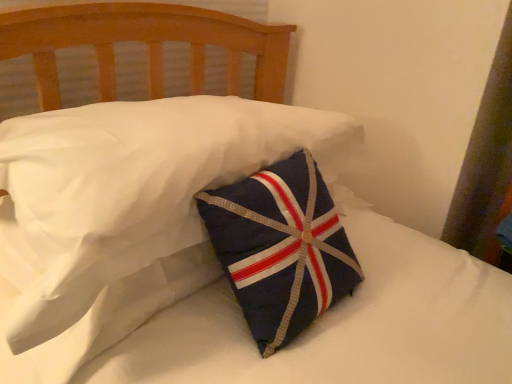
Measure the distance between navy fabric pillow at center and camera.

navy fabric pillow at center and camera are 18.88 inches apart from each other.

What do you see at coordinates (132, 201) in the screenshot? Image resolution: width=512 pixels, height=384 pixels. I see `navy fabric pillow at center` at bounding box center [132, 201].

Locate an element on the screen. Image resolution: width=512 pixels, height=384 pixels. navy fabric pillow at center is located at coordinates (132, 201).

I want to click on navy fabric pillow at center, so click(x=132, y=201).